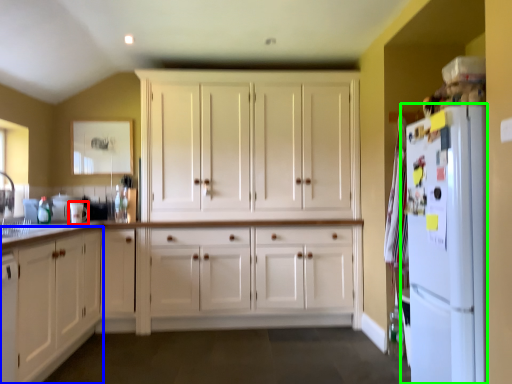
Question: Considering the real-world distances, which object is closest to appliance (highlighted by a red box)? cabinetry (highlighted by a blue box) or refrigerator (highlighted by a green box).

Choices:
 (A) cabinetry
 (B) refrigerator

Answer: (A)